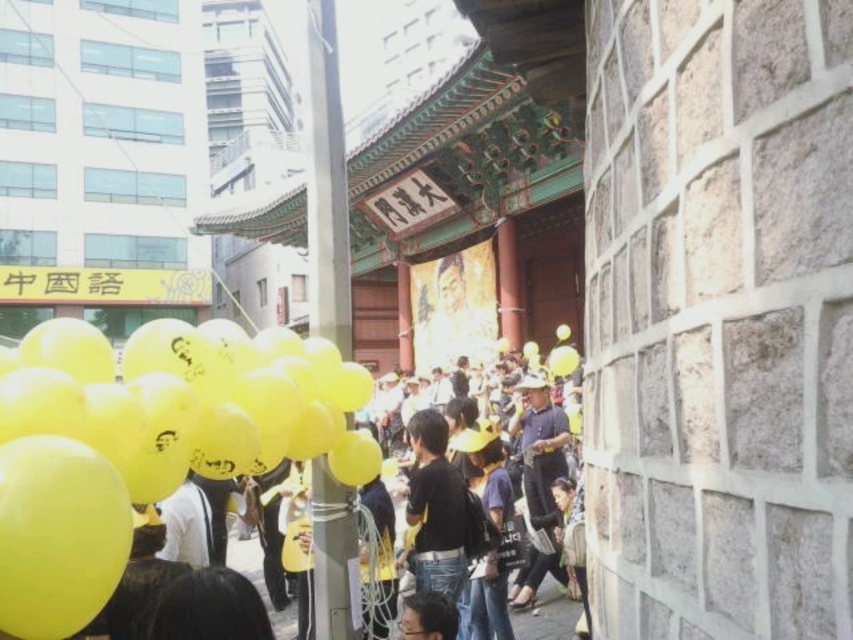
Question: Which of these objects is positioned farthest from the metallic silver pole at center?

Choices:
 (A) black matte shirt at center
 (B) yellow matte balloon at center

Answer: (A)

Question: Does yellow matte balloon at center appear over dark blue shirt at center?

Choices:
 (A) yes
 (B) no

Answer: (A)

Question: Does metallic silver pole at center appear on the left side of dark blue shirt at center?

Choices:
 (A) yes
 (B) no

Answer: (A)

Question: Is yellow matte balloon at center to the left of black matte shirt at center from the viewer's perspective?

Choices:
 (A) yes
 (B) no

Answer: (A)

Question: Based on their relative distances, which object is farther from the black matte shirt at center?

Choices:
 (A) metallic silver pole at center
 (B) dark blue shirt at center
 (C) yellow matte balloon at center

Answer: (C)

Question: Which of the following is the farthest from the observer?

Choices:
 (A) (552, 563)
 (B) (407, 500)
 (C) (35, 468)

Answer: (A)